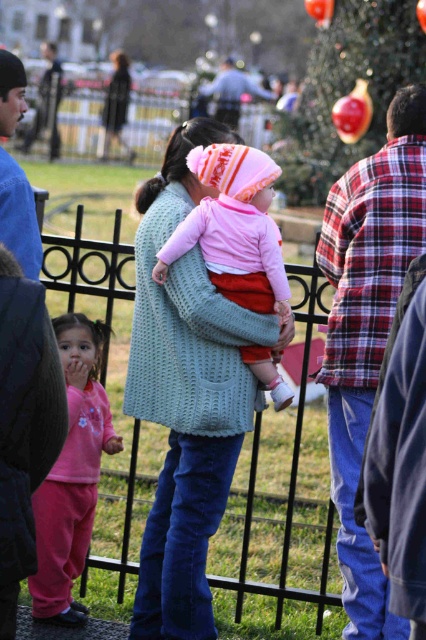
Is point (141, 620) closer to camera compared to point (85, 490)?

Yes, it is.

Does knitted light blue sweater at center have a lesser width compared to pink fleece pants at lower left?

No, knitted light blue sweater at center is not thinner than pink fleece pants at lower left.

What do you see at coordinates (187, 396) in the screenshot?
I see `knitted light blue sweater at center` at bounding box center [187, 396].

Identify the location of knitted light blue sweater at center. (187, 396).

Between point (204, 125) and point (221, 216), which one is positioned behind?

Point (204, 125)

This screenshot has height=640, width=426. In order to click on knitted light blue sweater at center in this screenshot , I will do click(187, 396).

Locate an element on the screen. This screenshot has height=640, width=426. knitted light blue sweater at center is located at coordinates (187, 396).

Measure the distance from matte pink sweater at center to pink fleece pants at lower left.

A distance of 1.14 meters exists between matte pink sweater at center and pink fleece pants at lower left.

Can you confirm if matte pink sweater at center is smaller than pink fleece pants at lower left?

Actually, matte pink sweater at center might be larger than pink fleece pants at lower left.

What do you see at coordinates (233, 228) in the screenshot? I see `matte pink sweater at center` at bounding box center [233, 228].

The height and width of the screenshot is (640, 426). Identify the location of matte pink sweater at center. (233, 228).